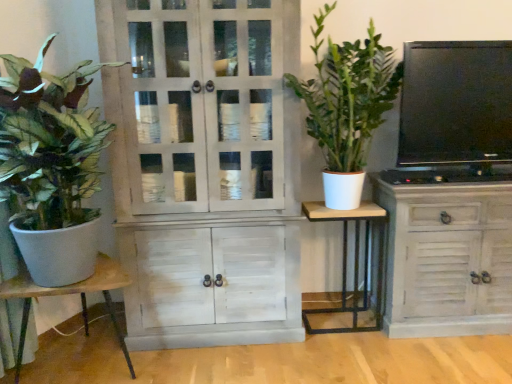
You are a GUI agent. You are given a task and a screenshot of the screen. Output one action in this format:
    pyautogui.click(x=<x>, y=<y>)
    Task: Click on the vacant space in between white wood cabinet at center, which appears as the first cabinetry when viewed from the left, and white wood table at center, arranged as the 2th table when viewed from the left
    The height and width of the screenshot is (384, 512).
    Given the screenshot: What is the action you would take?
    328,323